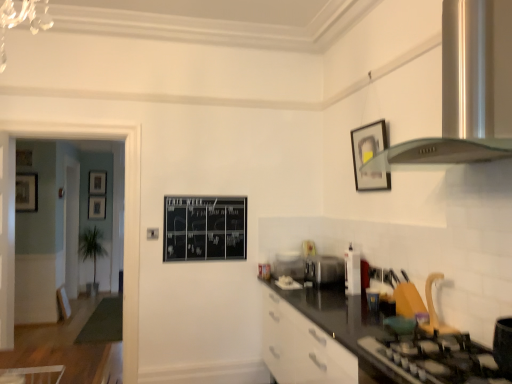
Question: Are wooden picture frame at left, which is counted as the 3th picture frame, starting from the front, and satin silver exhaust hood at upper right beside each other?

Choices:
 (A) no
 (B) yes

Answer: (A)

Question: From a real-world perspective, is wooden picture frame at left, acting as the third picture frame starting from the back, under satin silver exhaust hood at upper right?

Choices:
 (A) no
 (B) yes

Answer: (A)

Question: Does wooden picture frame at left, positioned as the 5th picture frame in right-to-left order, have a greater width compared to satin silver exhaust hood at upper right?

Choices:
 (A) yes
 (B) no

Answer: (B)

Question: Is wooden picture frame at left, acting as the third picture frame starting from the back, not near satin silver exhaust hood at upper right?

Choices:
 (A) yes
 (B) no

Answer: (A)

Question: From the image's perspective, is wooden picture frame at left, arranged as the first picture frame when viewed from the left, beneath satin silver exhaust hood at upper right?

Choices:
 (A) yes
 (B) no

Answer: (A)

Question: Is satin silver toaster at center, the second appliance viewed from the front, to the left or to the right of wooden picture frame at left, the 4th picture frame positioned from the back, in the image?

Choices:
 (A) right
 (B) left

Answer: (A)

Question: Is point (334, 264) positioned closer to the camera than point (28, 208)?

Choices:
 (A) closer
 (B) farther

Answer: (A)

Question: From a real-world perspective, is satin silver toaster at center, the second appliance viewed from the front, positioned above or below wooden picture frame at left, which is the 2th picture frame in left-to-right order?

Choices:
 (A) below
 (B) above

Answer: (A)

Question: Would you say satin silver toaster at center, the 2th appliance positioned from the left, is inside or outside wooden picture frame at left, placed as the 2th picture frame when sorted from front to back?

Choices:
 (A) inside
 (B) outside

Answer: (B)

Question: Considering the positions of satin silver toaster at center, the second appliance viewed from the front, and wooden picture frame at left, arranged as the first picture frame when viewed from the left, in the image, is satin silver toaster at center, the second appliance viewed from the front, wider or thinner than wooden picture frame at left, arranged as the first picture frame when viewed from the left,?

Choices:
 (A) thin
 (B) wide

Answer: (B)

Question: From the image's perspective, is satin silver toaster at center, the 2th appliance positioned from the left, positioned above or below wooden picture frame at left, arranged as the first picture frame when viewed from the left?

Choices:
 (A) below
 (B) above

Answer: (A)

Question: Based on their sizes in the image, would you say satin silver toaster at center, the second appliance viewed from the front, is bigger or smaller than wooden picture frame at left, arranged as the first picture frame when viewed from the left?

Choices:
 (A) small
 (B) big

Answer: (B)

Question: Choose the correct answer: Is satin silver toaster at center, the 2th appliance positioned from the left, inside wooden picture frame at left, positioned as the 5th picture frame in right-to-left order, or outside it?

Choices:
 (A) inside
 (B) outside

Answer: (B)

Question: From a real-world perspective, is satin silver exhaust hood at upper right positioned above or below black chalkboard at center?

Choices:
 (A) below
 (B) above

Answer: (B)

Question: From the image's perspective, is satin silver exhaust hood at upper right located above or below black chalkboard at center?

Choices:
 (A) above
 (B) below

Answer: (A)